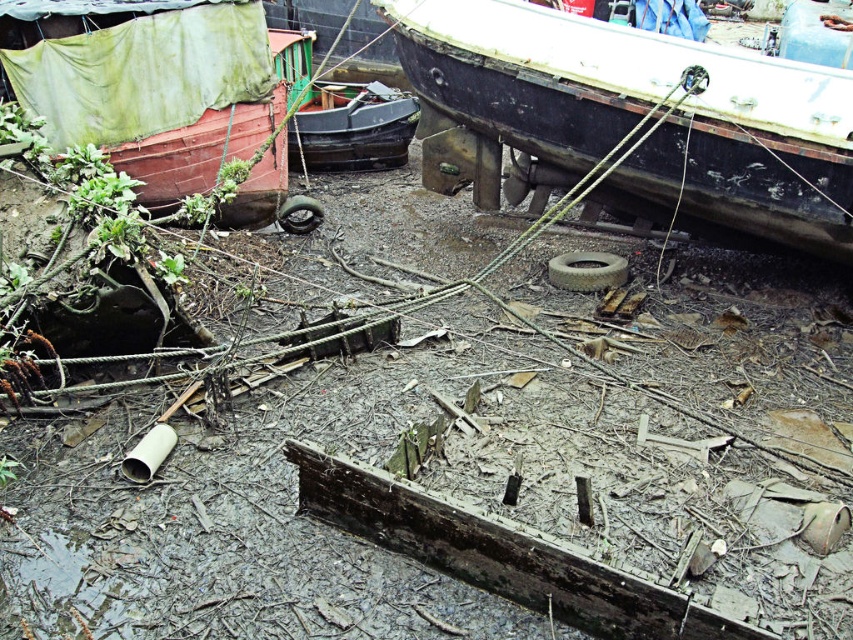
Is point (183, 186) positioned in front of point (277, 221)?

Yes, point (183, 186) is closer to viewer.

Is red matte boat at upper left thinner than rubber/rough tire at center?

Incorrect, red matte boat at upper left's width is not less than rubber/rough tire at center's.

Is point (265, 29) positioned in front of point (287, 205)?

Yes, it is.

Image resolution: width=853 pixels, height=640 pixels. Identify the location of red matte boat at upper left. (158, 93).

Who is shorter, rusty metal boat at upper right or gray rubber tire at center?

With less height is gray rubber tire at center.

Does rusty metal boat at upper right appear under gray rubber tire at center?

No, rusty metal boat at upper right is not below gray rubber tire at center.

Does point (795, 148) lie in front of point (566, 257)?

Yes.

Identify the location of rusty metal boat at upper right. The height and width of the screenshot is (640, 853). (637, 120).

Can you confirm if rusty metal boat at upper right is positioned above black matte boat at center?

Incorrect, rusty metal boat at upper right is not positioned above black matte boat at center.

Which is in front, point (650, 170) or point (287, 141)?

Point (650, 170) is in front.

Identify the location of rusty metal boat at upper right. (637, 120).

This screenshot has height=640, width=853. Find the location of `rusty metal boat at upper right`. rusty metal boat at upper right is located at coordinates (637, 120).